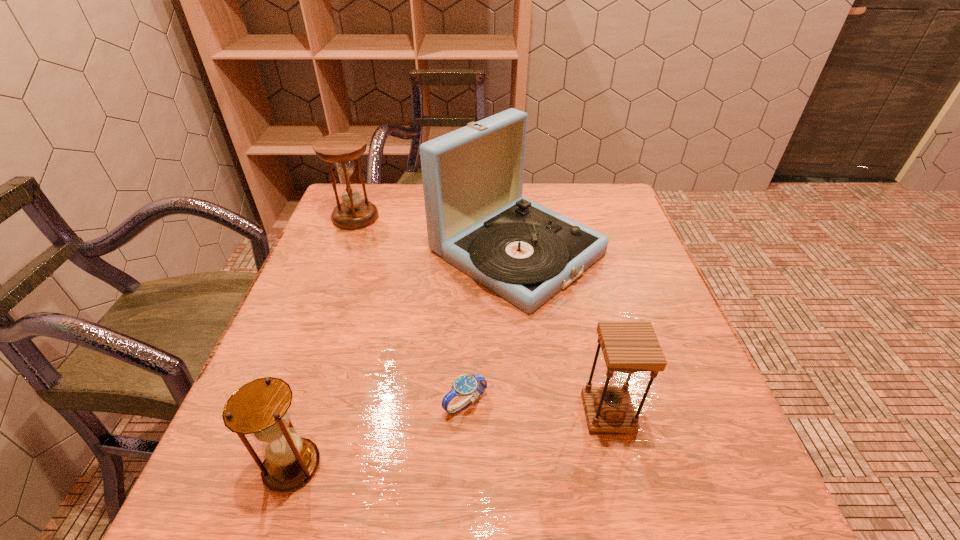
Image resolution: width=960 pixels, height=540 pixels. Find the location of `phonograph record`. phonograph record is located at coordinates (477, 220).

This screenshot has width=960, height=540. Identify the location of the farthest hourglass. (354, 213).

The height and width of the screenshot is (540, 960). Find the location of `the rightmost hourglass`. the rightmost hourglass is located at coordinates (628, 347).

Identify the location of the nearest object. (260, 408).

Where is `watch`? watch is located at coordinates (472, 386).

Image resolution: width=960 pixels, height=540 pixels. What are the coordinates of `vacant space located 0.240m on the front of the phonograph record` in the screenshot? It's located at (534, 417).

This screenshot has width=960, height=540. Find the location of `free space located on the front of the farthest hourglass`. free space located on the front of the farthest hourglass is located at coordinates (325, 295).

Locate an element on the screen. The height and width of the screenshot is (540, 960). vacant space situated 0.200m on the back of the second farthest hourglass is located at coordinates (584, 313).

Where is `blank space located on the back of the nearest object`? The image size is (960, 540). blank space located on the back of the nearest object is located at coordinates (334, 337).

At what (x,y) coordinates should I click in order to perform the action: click on vacant space located on the left of the shortest object. Please return your answer as a coordinate pair (x, y). Looking at the image, I should click on (340, 403).